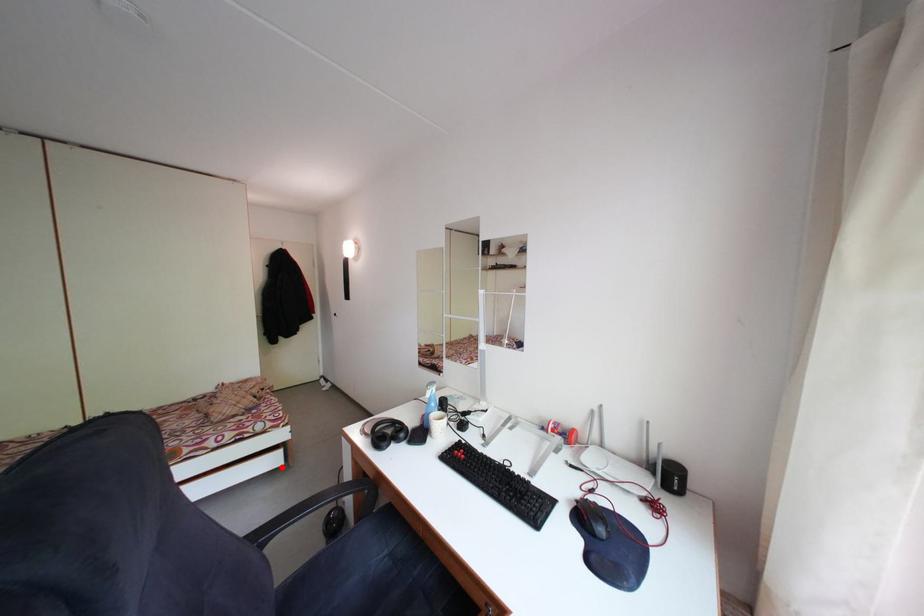
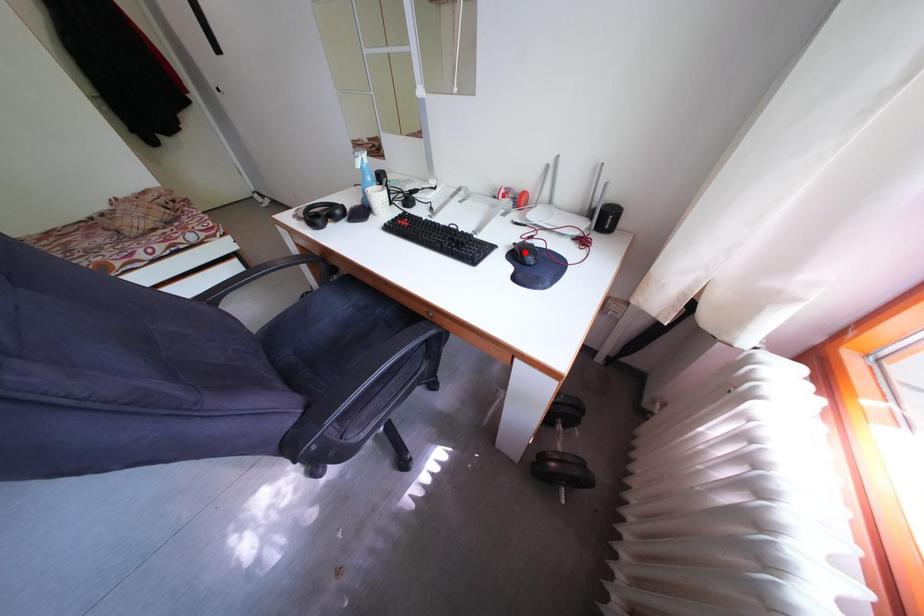
I am providing you with two images of the same scene from different viewpoints. A red point is marked on the first image and another point is marked on the second image. Is the marked point in image1 the same physical position as the marked point in image2?

No